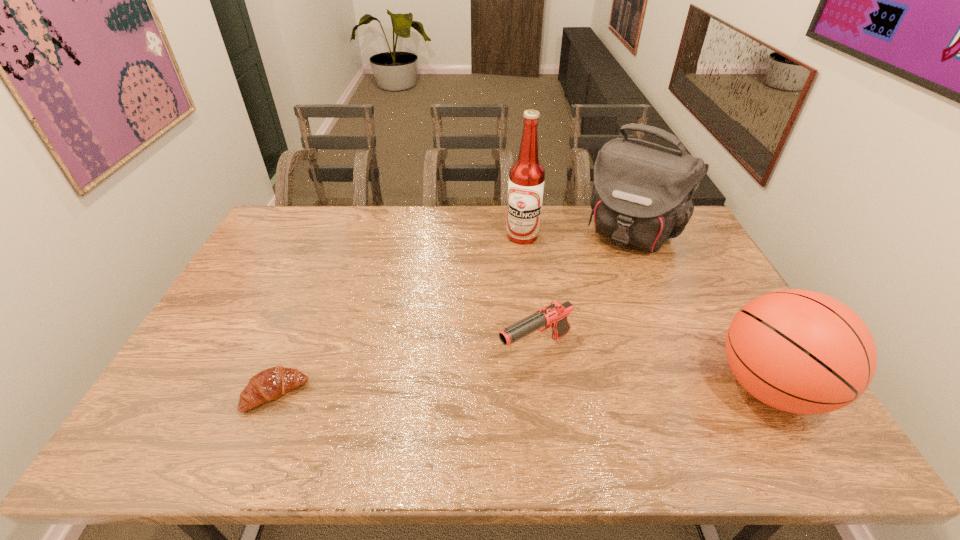
Locate an element on the screen. free spot between the crescent roll and the alcohol is located at coordinates (399, 315).

Locate an element on the screen. The width and height of the screenshot is (960, 540). free point between the second shortest object and the alcohol is located at coordinates (529, 293).

Identify the location of free point between the fourth shortest object and the second shortest object. (585, 291).

Identify the location of free space between the alcohol and the gun. (529, 293).

This screenshot has height=540, width=960. I want to click on free space between the basketball and the alcohol, so click(646, 312).

Find the location of a particular element. The height and width of the screenshot is (540, 960). empty location between the third tallest object and the crescent roll is located at coordinates (523, 390).

Find the location of a particular element. This screenshot has width=960, height=540. unoccupied area between the leftmost object and the third shortest object is located at coordinates (523, 390).

Identify the location of vacant space in between the shortest object and the fourth tallest object. Image resolution: width=960 pixels, height=540 pixels. (406, 372).

Locate an element on the screen. vacant space that's between the shortest object and the second tallest object is located at coordinates (455, 313).

The image size is (960, 540). Identify the location of vacant area between the third tallest object and the shoulder bag. (702, 309).